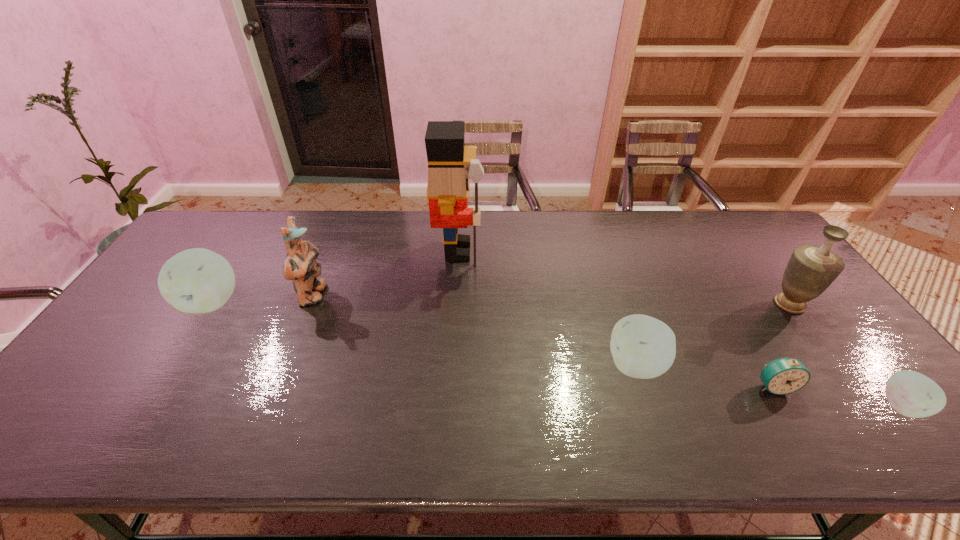
Identify the location of free space for an extra apple to achieve even spacing. (409, 332).